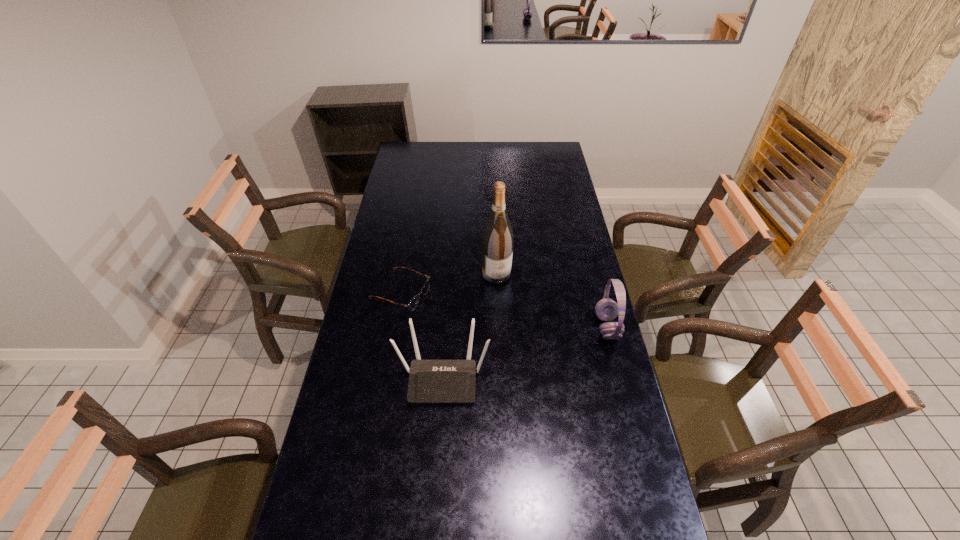
Find the location of a particular element. free spot on the desktop that is between the nearest object and the headset and is positioned on the label of the tallest object is located at coordinates (532, 350).

The image size is (960, 540). Find the location of `free spot on the desktop that is between the nearest object and the headset and is positioned on the front-facing side of the shortest object`. free spot on the desktop that is between the nearest object and the headset and is positioned on the front-facing side of the shortest object is located at coordinates (543, 346).